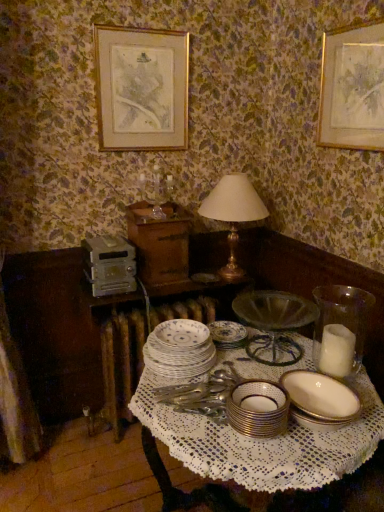
This screenshot has width=384, height=512. Identify the location of blank area to the left of gold metallic bowl at center, marked as the 1th tableware in a front-to-back arrangement. (201, 431).